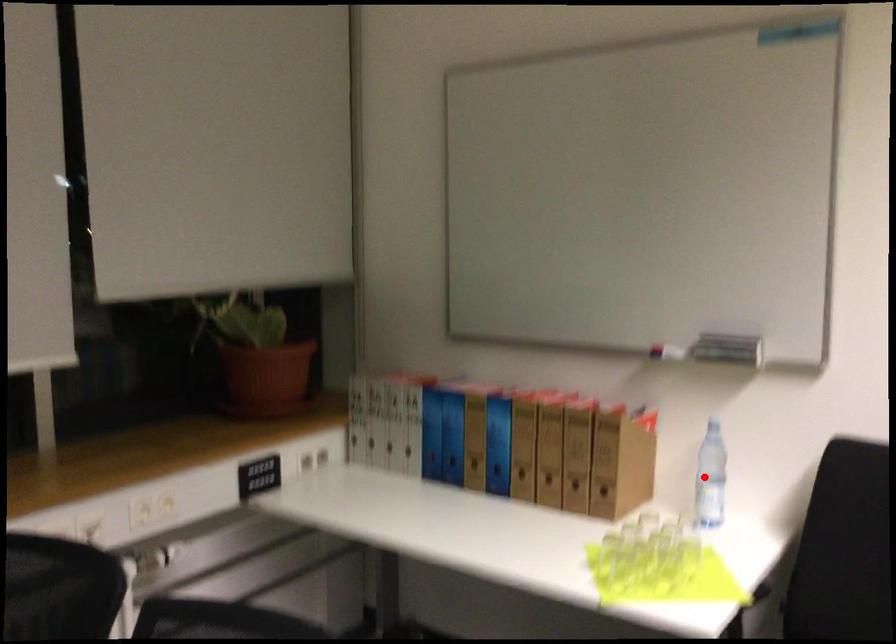
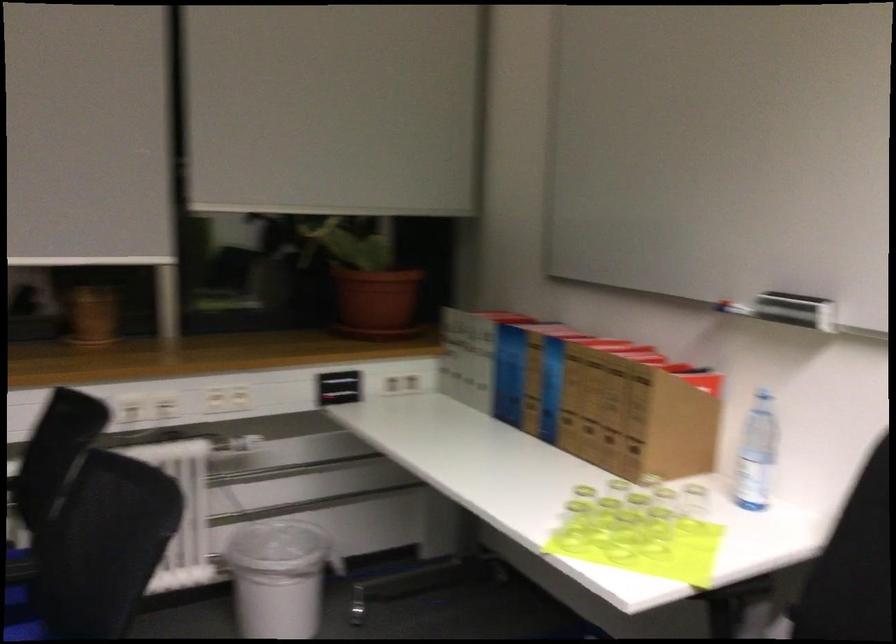
Locate, in the second image, the point that corresponds to the highlighted location in the first image.

(755, 453)